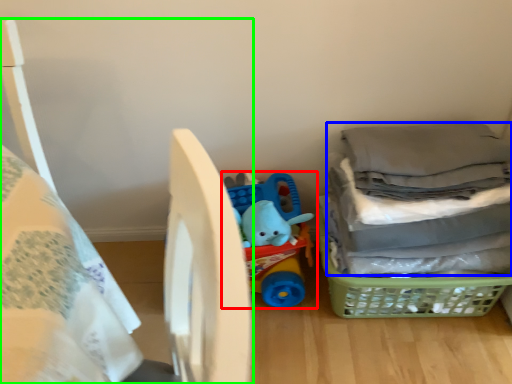
Question: Which object is the closest to the toy (highlighted by a red box)? Choose among these: laundry (highlighted by a blue box) or bed (highlighted by a green box).

Choices:
 (A) laundry
 (B) bed

Answer: (A)